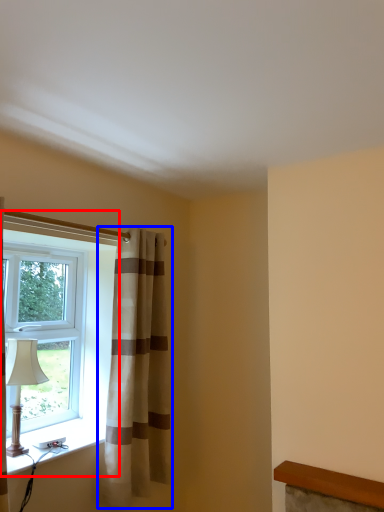
Question: Which point is closer to the camera, window (highlighted by a red box) or curtain (highlighted by a blue box)?

Choices:
 (A) window
 (B) curtain

Answer: (B)